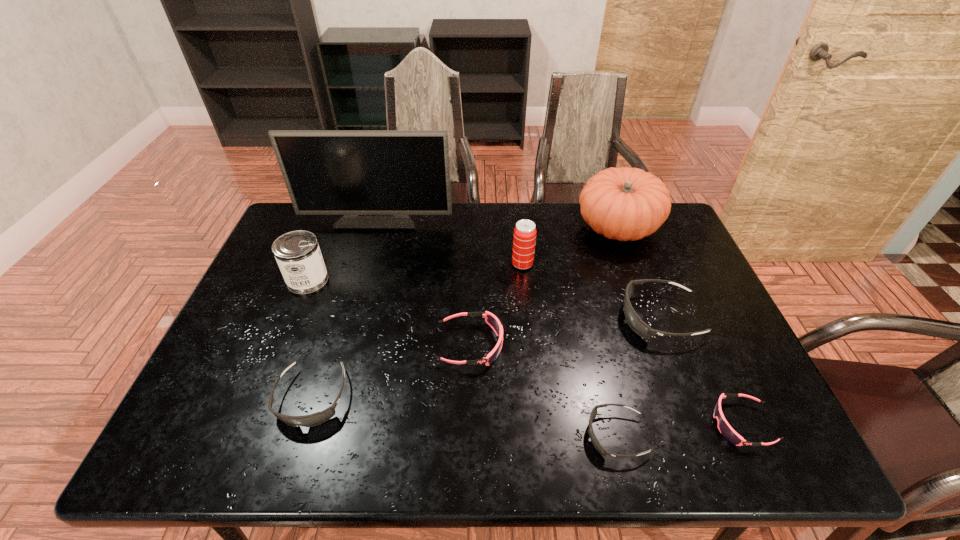
Identify the location of vacant area between the nearer pink goggles and the tallest goggles. The image size is (960, 540). (701, 371).

I want to click on object that can be found as the closest to the can, so click(376, 178).

This screenshot has width=960, height=540. I want to click on the second closest object relative to the fifth object from left to right, so click(491, 320).

This screenshot has height=540, width=960. What are the coordinates of `the fourth closest goggles to the can` in the screenshot? It's located at (635, 322).

This screenshot has width=960, height=540. In order to click on goggles that is the closest to the smallest black goggles in this screenshot , I will do `click(726, 430)`.

I want to click on black goggles that is the second closest to the soda can, so click(596, 443).

Identify which black goggles is the third nearest to the fifth object from left to right. Please provide its 2D coordinates. Your answer should be formatted as a tuple, i.e. [(x, y)], where the tuple contains the x and y coordinates of a point satisfying the conditions above.

[(317, 418)]

You are a GUI agent. You are given a task and a screenshot of the screen. Output one action in this format:
    pyautogui.click(x=<x>, y=<y>)
    Task: Click on the free point that satisfies the following two spatial constraints: 1. on the screen side of the monitor; 2. on the right side of the soda can
    The width and height of the screenshot is (960, 540).
    Given the screenshot: What is the action you would take?
    pyautogui.click(x=365, y=264)

At what (x,y) coordinates should I click in order to perform the action: click on free space that satisfies the following two spatial constraints: 1. on the front-facing side of the farther pink goggles; 2. on the lenses of the leftmost black goggles. Please return your answer as a coordinate pair (x, y). The image size is (960, 540). Looking at the image, I should click on coord(469,397).